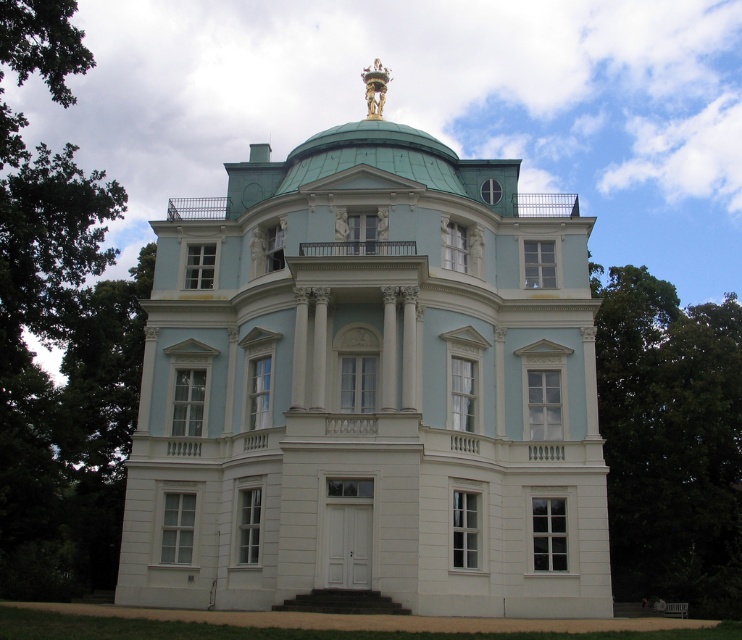
Who is shorter, light blue stone mansion at center or green metallic dome at center?

With less height is green metallic dome at center.

Can you confirm if light blue stone mansion at center is positioned above green metallic dome at center?

No.

Is point (482, 509) more distant than point (378, 108)?

No, it is in front of (378, 108).

Locate an element on the screen. This screenshot has width=742, height=640. light blue stone mansion at center is located at coordinates (370, 387).